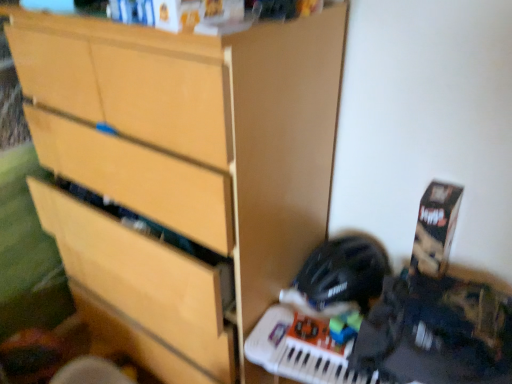
Question: In terms of size, does black matte helmet at lower right appear bigger or smaller than matte wood chest of drawers at center?

Choices:
 (A) small
 (B) big

Answer: (A)

Question: Considering the positions of black matte helmet at lower right and matte wood chest of drawers at center in the image, is black matte helmet at lower right wider or thinner than matte wood chest of drawers at center?

Choices:
 (A) thin
 (B) wide

Answer: (A)

Question: From a real-world perspective, is black matte helmet at lower right physically located above or below matte wood chest of drawers at center?

Choices:
 (A) above
 (B) below

Answer: (B)

Question: Is matte wood chest of drawers at center situated inside black matte helmet at lower right or outside?

Choices:
 (A) outside
 (B) inside

Answer: (A)

Question: Looking at the image, does matte wood chest of drawers at center seem bigger or smaller compared to black matte helmet at lower right?

Choices:
 (A) big
 (B) small

Answer: (A)

Question: From a real-world perspective, relative to black matte helmet at lower right, is matte wood chest of drawers at center vertically above or below?

Choices:
 (A) below
 (B) above

Answer: (B)

Question: Is point (224, 301) positioned closer to the camera than point (332, 273)?

Choices:
 (A) closer
 (B) farther

Answer: (A)